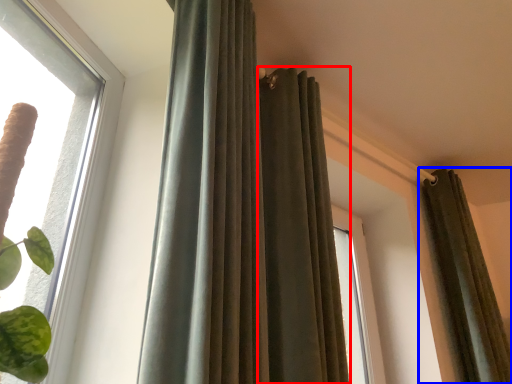
Question: Among these objects, which one is farthest to the camera, curtain (highlighted by a red box) or curtain (highlighted by a blue box)?

Choices:
 (A) curtain
 (B) curtain

Answer: (B)